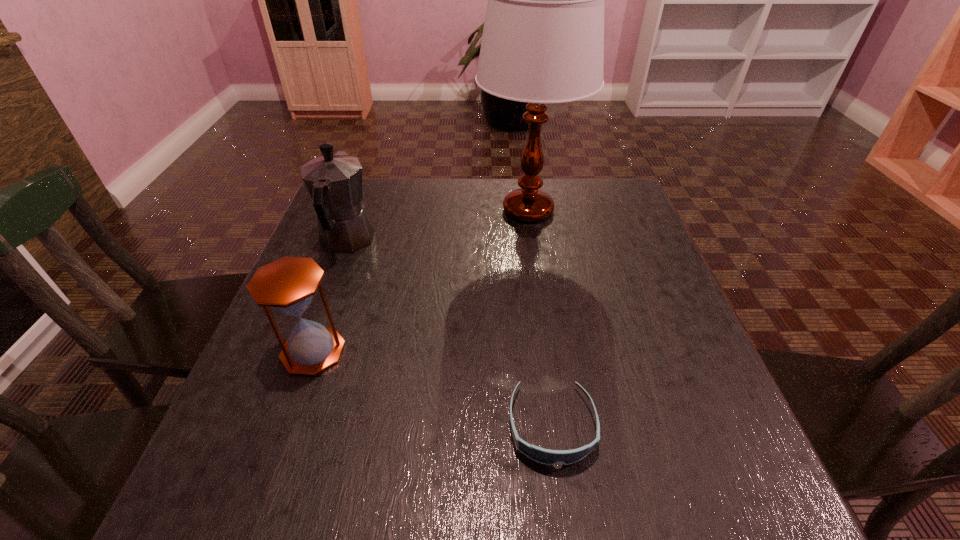
Locate an element on the screen. The image size is (960, 540). free space located on the right of the second nearest object is located at coordinates (391, 352).

You are a GUI agent. You are given a task and a screenshot of the screen. Output one action in this format:
    pyautogui.click(x=<x>, y=<y>)
    Task: Click on the free space located on the front-facing side of the nearest object
    
    Given the screenshot: What is the action you would take?
    (x=563, y=505)

At what (x,y) coordinates should I click in order to perform the action: click on table lamp that is at the far edge. Please return your answer as a coordinate pair (x, y). The height and width of the screenshot is (540, 960). Looking at the image, I should click on click(543, 39).

Where is `coffeepot located at the far edge`? The width and height of the screenshot is (960, 540). coffeepot located at the far edge is located at coordinates (334, 181).

Locate an element on the screen. The image size is (960, 540). object located at the near edge is located at coordinates (544, 456).

What are the coordinates of `coffeepot that is positioned at the left edge` in the screenshot? It's located at (334, 181).

In order to click on hourglass that is at the left edge in this screenshot , I will do `click(288, 284)`.

Find the location of `object located at the right edge`. object located at the right edge is located at coordinates (543, 39).

Image resolution: width=960 pixels, height=540 pixels. I want to click on object situated at the far left corner, so click(x=334, y=181).

The image size is (960, 540). In order to click on object situated at the far right corner in this screenshot , I will do `click(543, 39)`.